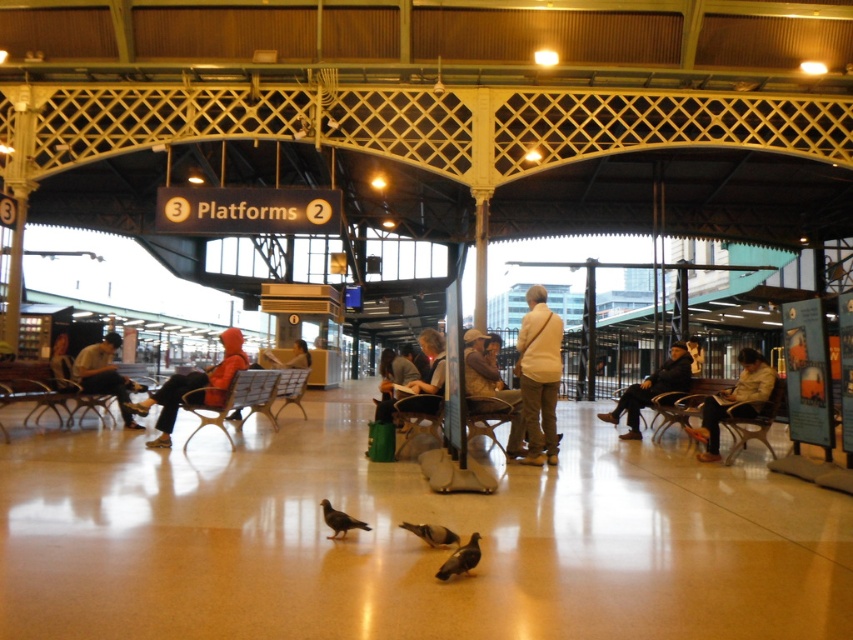
Question: Which object is closer to the camera taking this photo?

Choices:
 (A) dark gray fabric jacket at center
 (B) orange hoodie at center
 (C) brown matte pigeon at center
 (D) gray matte pigeon at center

Answer: (D)

Question: Can you confirm if gray matte pigeon at lower center is bigger than brown matte pigeon at center?

Choices:
 (A) no
 (B) yes

Answer: (B)

Question: Which point is closer to the camera?

Choices:
 (A) gray matte pigeon at center
 (B) light brown leather jacket at center
 (C) matte black jacket at left
 (D) gray matte pigeon at lower center

Answer: (D)

Question: Does light beige fabric jacket at center have a lesser width compared to dark gray fabric jacket at center?

Choices:
 (A) yes
 (B) no

Answer: (B)

Question: Estimate the real-world distances between objects in this image. Which object is farther from the gray matte pigeon at lower center?

Choices:
 (A) light beige fabric jacket at center
 (B) matte black jacket at left
 (C) gray matte pigeon at center

Answer: (B)

Question: Can you confirm if matte black jacket at left is positioned to the left of gray matte pigeon at lower center?

Choices:
 (A) yes
 (B) no

Answer: (A)